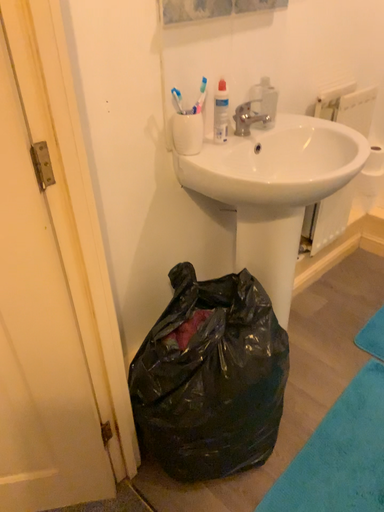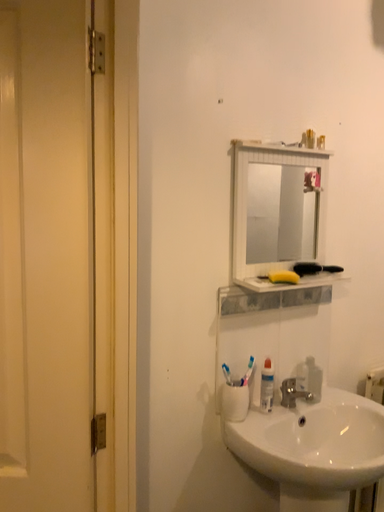
Question: How did the camera likely rotate when shooting the video?

Choices:
 (A) rotated right
 (B) rotated left

Answer: (B)